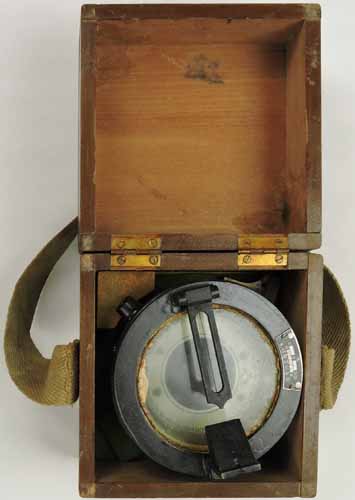
Identify the location of wooden box. The height and width of the screenshot is (500, 355). (191, 175).